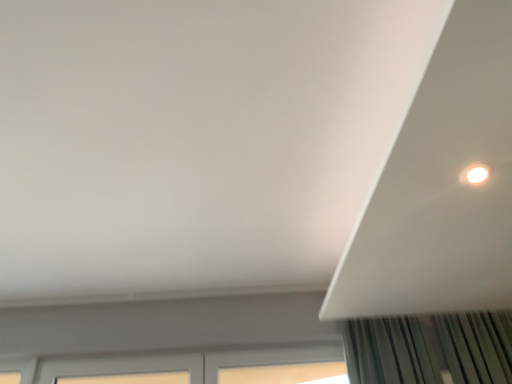
Question: From a real-world perspective, is white matte exhaust hood at upper right located higher than white wooden window at lower center?

Choices:
 (A) no
 (B) yes

Answer: (B)

Question: Are white matte exhaust hood at upper right and white wooden window at lower center located far from each other?

Choices:
 (A) yes
 (B) no

Answer: (A)

Question: Is white matte exhaust hood at upper right turned away from white wooden window at lower center?

Choices:
 (A) yes
 (B) no

Answer: (B)

Question: Can you confirm if white matte exhaust hood at upper right is thinner than white wooden window at lower center?

Choices:
 (A) yes
 (B) no

Answer: (B)

Question: Does white matte exhaust hood at upper right have a greater height compared to white wooden window at lower center?

Choices:
 (A) no
 (B) yes

Answer: (A)

Question: Is white matte exhaust hood at upper right wider than white wooden window at lower center?

Choices:
 (A) no
 (B) yes

Answer: (B)

Question: Does white wooden window at lower center have a lesser width compared to white matte exhaust hood at upper right?

Choices:
 (A) yes
 (B) no

Answer: (A)

Question: Is white wooden window at lower center positioned beyond the bounds of white matte exhaust hood at upper right?

Choices:
 (A) yes
 (B) no

Answer: (A)

Question: Is white wooden window at lower center at the left side of white matte exhaust hood at upper right?

Choices:
 (A) yes
 (B) no

Answer: (A)

Question: Is white wooden window at lower center not close to white matte exhaust hood at upper right?

Choices:
 (A) no
 (B) yes

Answer: (B)

Question: Can you confirm if white wooden window at lower center is taller than white matte exhaust hood at upper right?

Choices:
 (A) no
 (B) yes

Answer: (B)

Question: Does white wooden window at lower center come behind white matte exhaust hood at upper right?

Choices:
 (A) yes
 (B) no

Answer: (A)

Question: Is point (309, 375) closer or farther from the camera than point (360, 279)?

Choices:
 (A) farther
 (B) closer

Answer: (A)